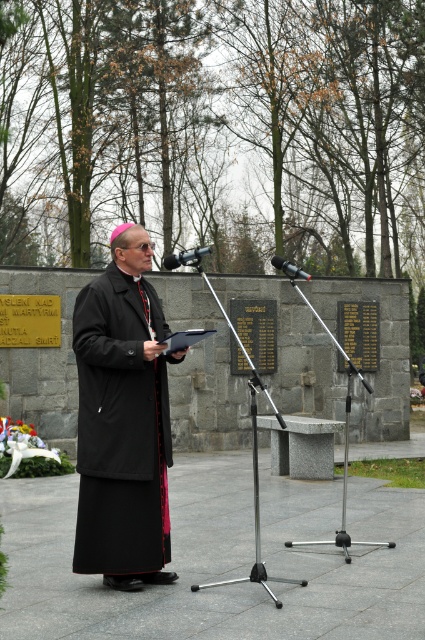
Does metallic silver microphone at center appear on the right side of black metallic microphone at center?

No, metallic silver microphone at center is not to the right of black metallic microphone at center.

How distant is metallic silver microphone at center from black metallic microphone at center?

metallic silver microphone at center is 2.68 meters from black metallic microphone at center.

Is point (204, 250) in front of point (297, 273)?

Yes, point (204, 250) is in front of point (297, 273).

At what (x,y) coordinates should I click in order to perform the action: click on metallic silver microphone at center. Please return your answer as a coordinate pair (x, y). Looking at the image, I should click on (187, 257).

Does black woolen robe at center lie in front of black metallic microphone at center?

Yes, black woolen robe at center is closer to the viewer.

The height and width of the screenshot is (640, 425). In order to click on black woolen robe at center in this screenshot , I will do `click(121, 429)`.

This screenshot has height=640, width=425. Describe the element at coordinates (121, 429) in the screenshot. I see `black woolen robe at center` at that location.

The image size is (425, 640). I want to click on black woolen robe at center, so click(121, 429).

Which is above, black woolen robe at center or metallic silver microphone at center?

metallic silver microphone at center is higher up.

Is point (124, 355) farther from camera compared to point (173, 264)?

That is False.

At what (x,y) coordinates should I click in order to perform the action: click on black woolen robe at center. Please return your answer as a coordinate pair (x, y). Looking at the image, I should click on (121, 429).